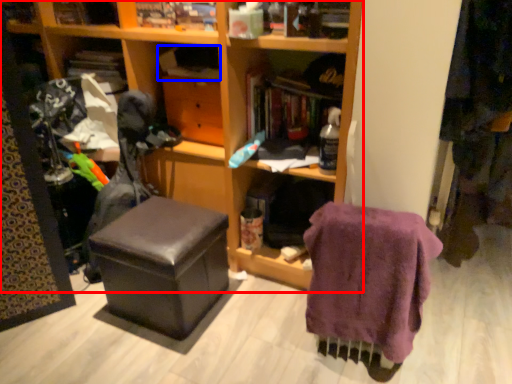
Question: Among these objects, which one is farthest to the camera, furniture (highlighted by a red box) or book (highlighted by a blue box)?

Choices:
 (A) furniture
 (B) book

Answer: (B)